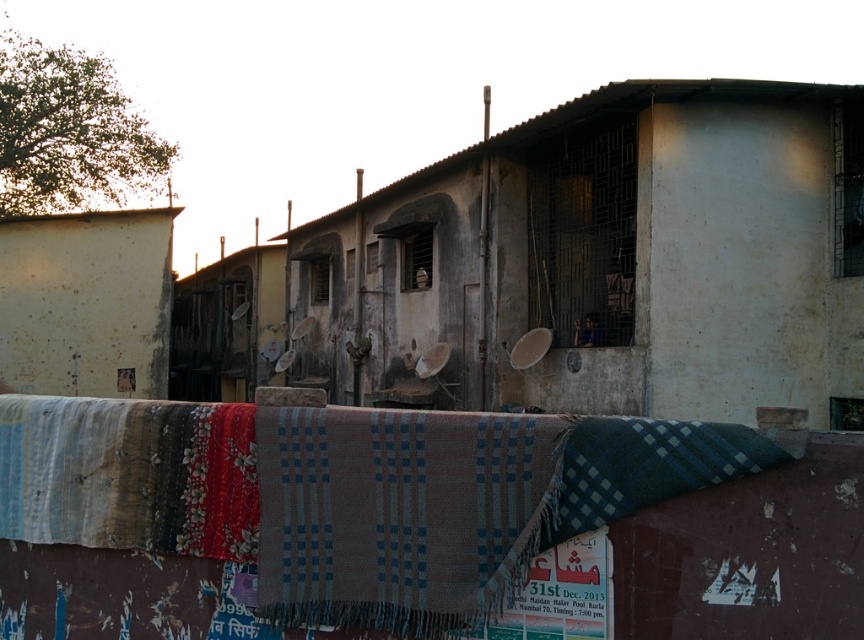
Where is the plaid woolen blanket at center located in the image?

The plaid woolen blanket at center is located at point [399,513] in the image.

You are a delivery person trying to place a package on the plaid woolen blanket at center. However, there is a white rough wall at left in the way. Can you place the package on the blanket without moving the wall?

The plaid woolen blanket at center is located below the white rough wall at left, so you can place the package on the plaid woolen blanket at center as it is positioned under the wall.

You are standing in front of the building and want to know how far the point at coordinates (x=302, y=524) is from you. Can you determine the distance?

The point at coordinates (x=302, y=524) is 15.01 feet away from the viewer.